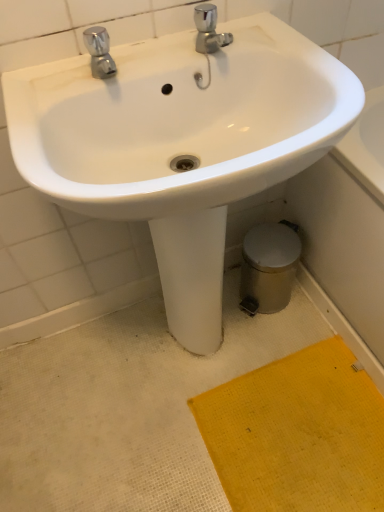
At what (x,y) coordinates should I click in order to perform the action: click on vacant region in front of white glossy sink at center. Please return your answer as a coordinate pair (x, y). The image size is (384, 512). Looking at the image, I should click on (223, 458).